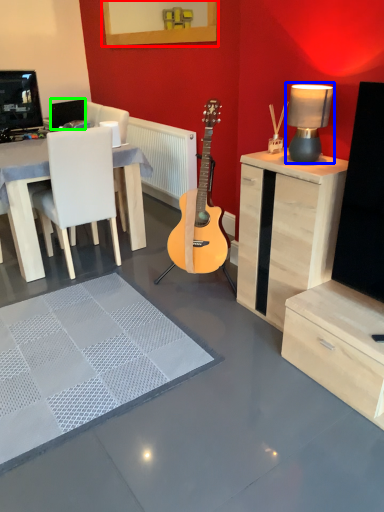
Question: Which is farther away from picture frame (highlighted by a red box)? table lamp (highlighted by a blue box) or speaker (highlighted by a green box)?

Choices:
 (A) table lamp
 (B) speaker

Answer: (A)